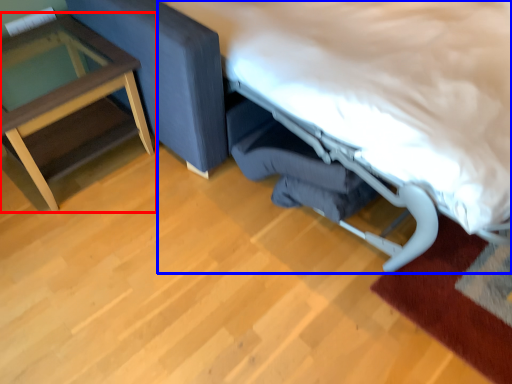
Question: Which point is closer to the camera, table (highlighted by a red box) or bed (highlighted by a blue box)?

Choices:
 (A) table
 (B) bed

Answer: (B)